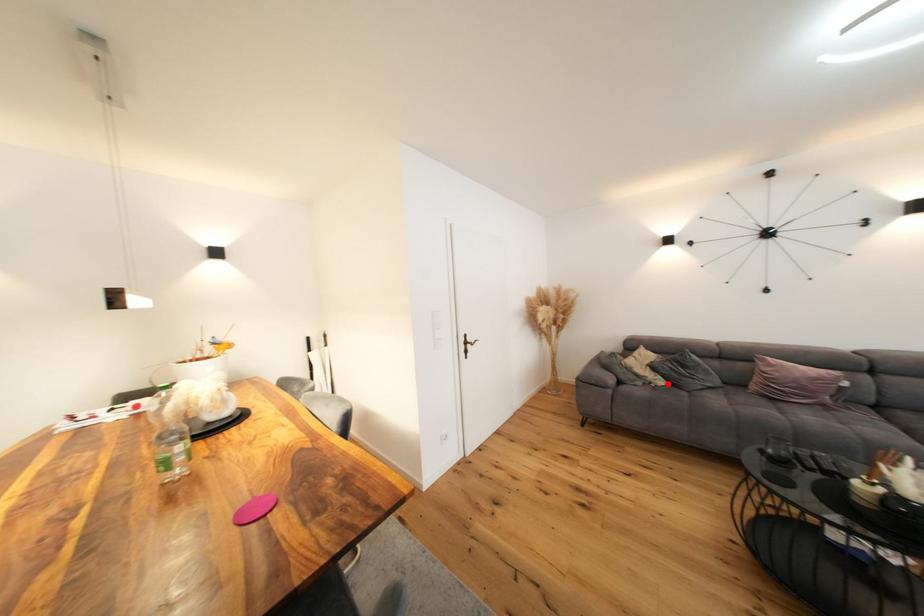
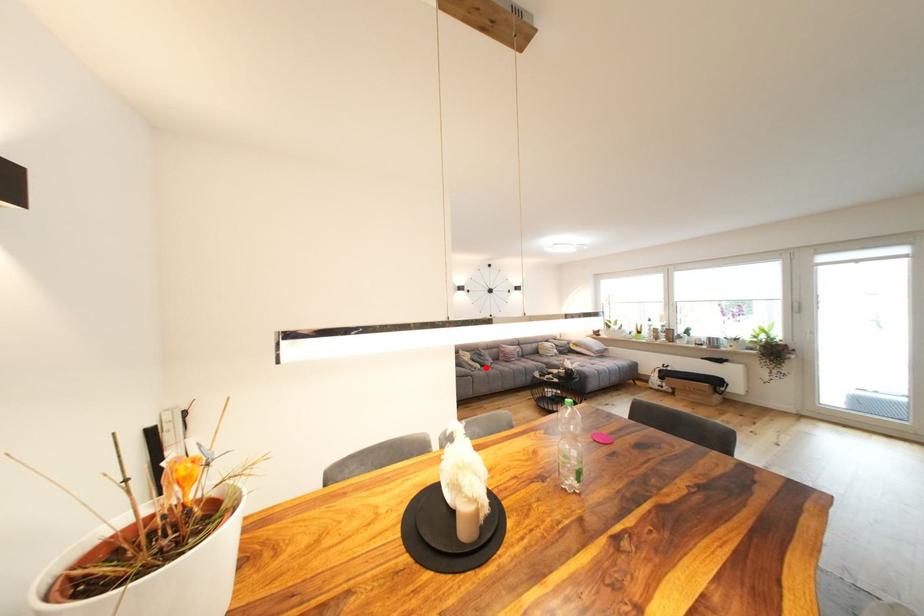
I am providing you with two images of the same scene from different viewpoints. A red point is marked on the first image and another point is marked on the second image. Do the highlighted points in image1 and image2 indicate the same real-world spot?

Yes